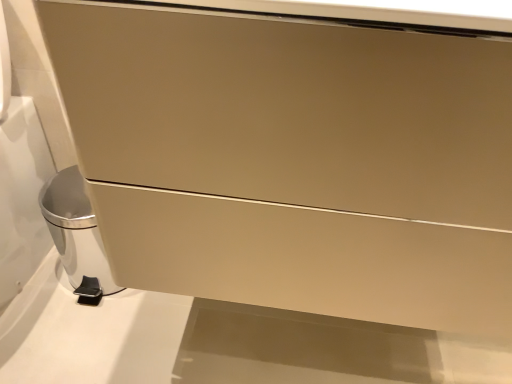
In order to face silver metallic trash can at lower left, should I rotate leftwards or rightwards?

You should rotate left by 20.006 degrees.

Locate an element on the screen. The width and height of the screenshot is (512, 384). silver metallic trash can at lower left is located at coordinates (77, 234).

The image size is (512, 384). What do you see at coordinates (77, 234) in the screenshot? I see `silver metallic trash can at lower left` at bounding box center [77, 234].

At what (x,y) coordinates should I click in order to perform the action: click on silver metallic trash can at lower left. Please return your answer as a coordinate pair (x, y). The width and height of the screenshot is (512, 384). Looking at the image, I should click on (77, 234).